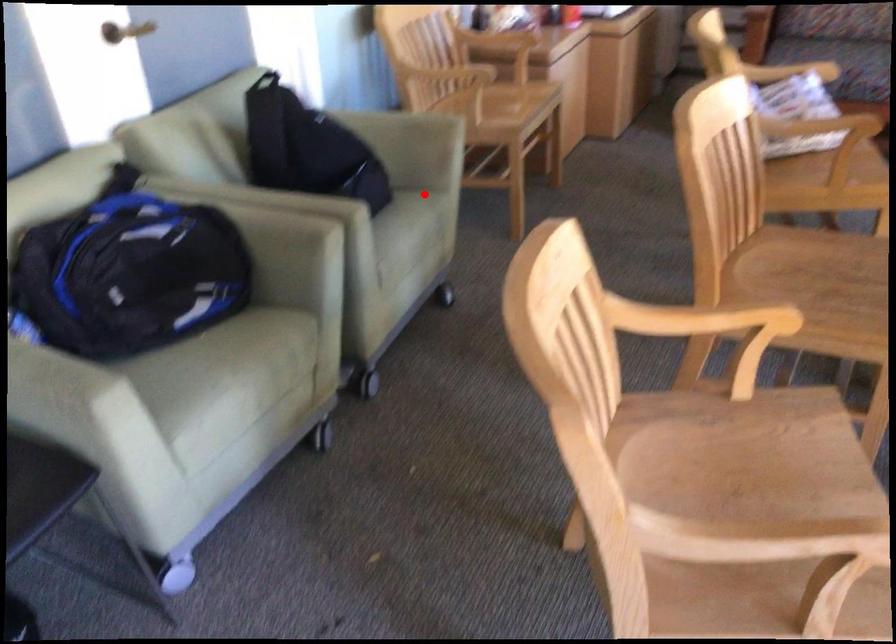
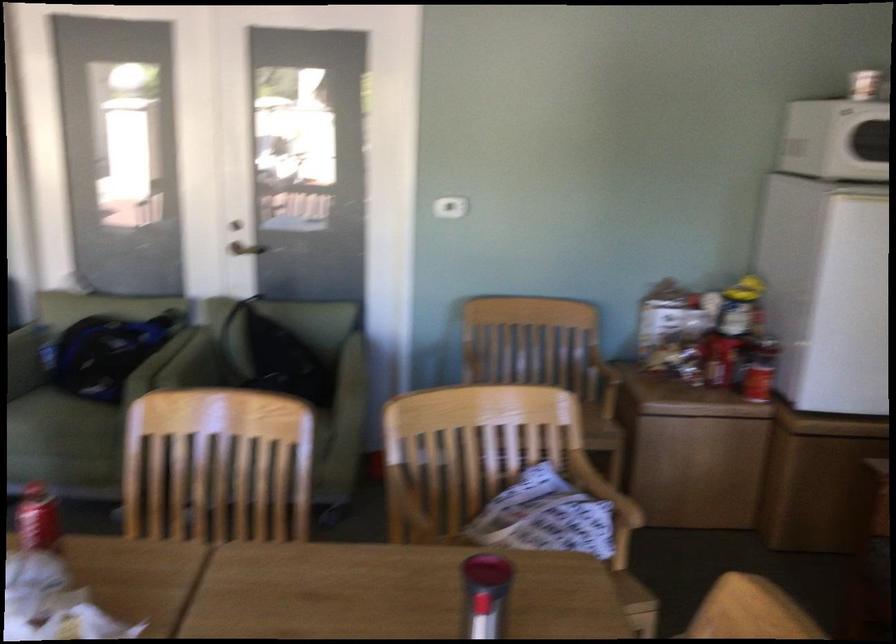
The point at the highlighted location is marked in the first image. Where is the corresponding point in the second image?

(322, 436)